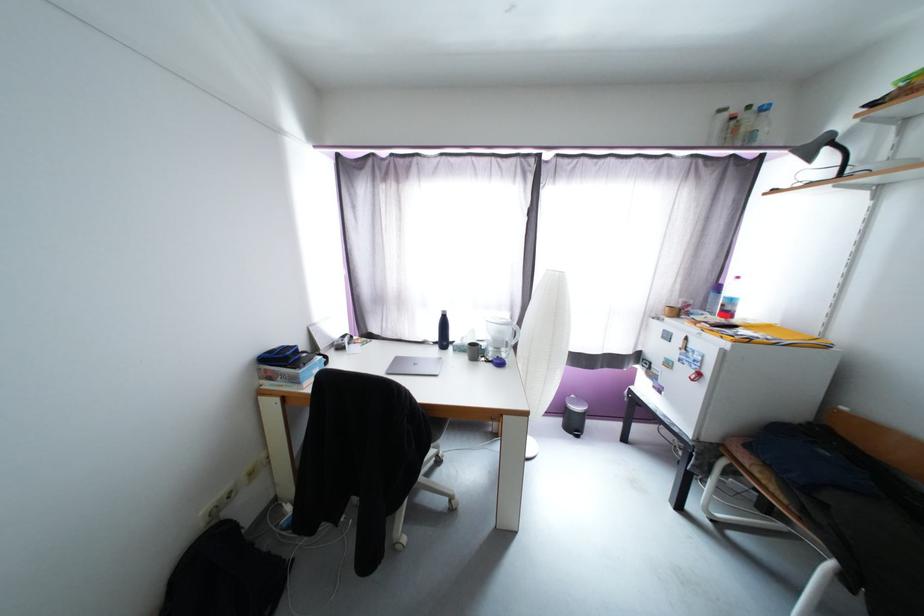
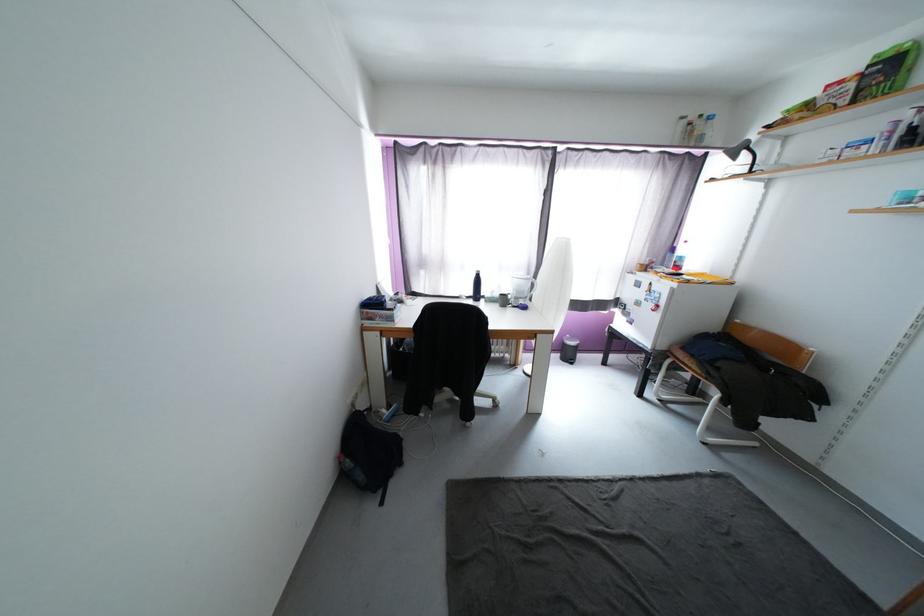
In the second image, find the point that corresponds to point 445,317 in the first image.

(480, 277)